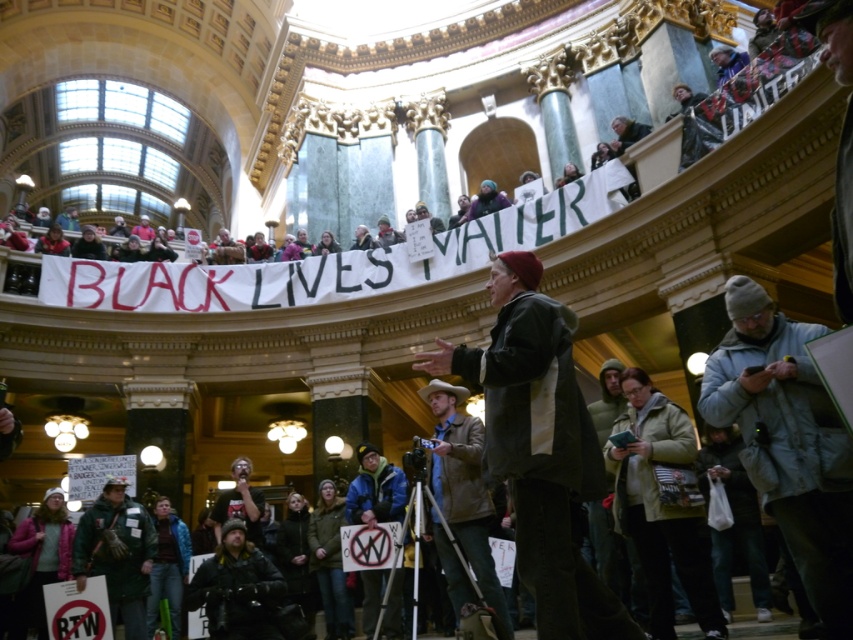
Question: Which point is farther to the camera?

Choices:
 (A) (144, 611)
 (B) (469, 509)
 (C) (550, 317)
 (D) (229, 568)

Answer: (A)

Question: Does dark gray jacket at center have a smaller size compared to gray fleece jacket at lower right?

Choices:
 (A) yes
 (B) no

Answer: (B)

Question: Which of the following is the closest to the observer?

Choices:
 (A) camouflage jacket at lower left
 (B) brown leather jacket at center

Answer: (B)

Question: Does dark gray jacket at center appear over camouflage jacket at lower left?

Choices:
 (A) yes
 (B) no

Answer: (A)

Question: Which object appears closest to the camera in this image?

Choices:
 (A) brown leather jacket at center
 (B) gray fleece jacket at lower right
 (C) camouflage jacket at lower left

Answer: (B)

Question: Where is brown leather jacket at center located in relation to dark gray hoodie at lower center in the image?

Choices:
 (A) right
 (B) left

Answer: (A)